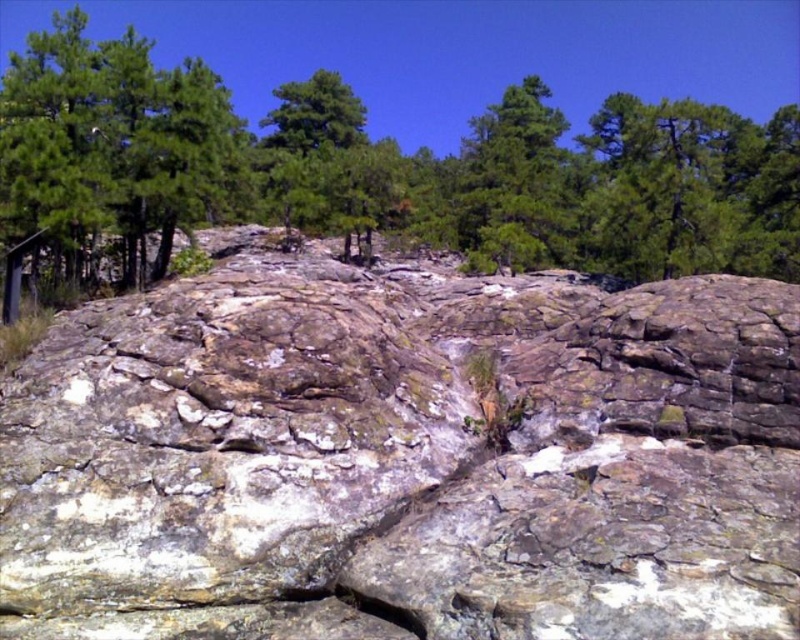
Can you confirm if rocky surface at center is shorter than green leafy tree at upper center?

Correct, rocky surface at center is not as tall as green leafy tree at upper center.

Is point (252, 317) farther from camera compared to point (536, 228)?

No, it is in front of (536, 228).

Where is `rocky surface at center`? The image size is (800, 640). rocky surface at center is located at coordinates (404, 458).

Between green leafy tree at upper center and green textured tree at left, which one has more height?

Standing taller between the two is green leafy tree at upper center.

Is green leafy tree at upper center shorter than green textured tree at left?

In fact, green leafy tree at upper center may be taller than green textured tree at left.

Find the location of `green leafy tree at upper center`. green leafy tree at upper center is located at coordinates tap(384, 168).

Can you confirm if rocky surface at center is shorter than green textured tree at left?

Indeed, rocky surface at center has a lesser height compared to green textured tree at left.

Who is more forward, (458, 449) or (60, 150)?

Point (458, 449)

Where is `rocky surface at center`? The width and height of the screenshot is (800, 640). rocky surface at center is located at coordinates (404, 458).